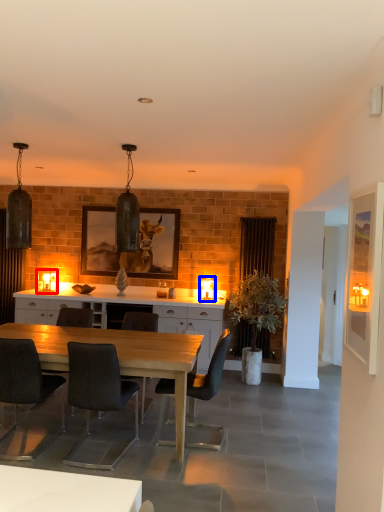
Question: Among these objects, which one is farthest to the camera, lamp (highlighted by a red box) or lamp (highlighted by a blue box)?

Choices:
 (A) lamp
 (B) lamp

Answer: (A)